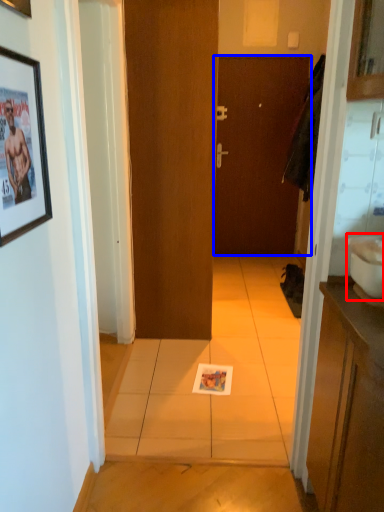
Question: Which object is closer to the camera taking this photo, sink (highlighted by a red box) or door (highlighted by a blue box)?

Choices:
 (A) sink
 (B) door

Answer: (A)